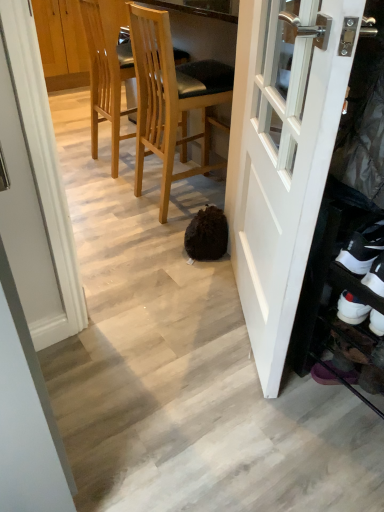
Find the location of a particular element. unoccupied area in front of light brown wood chair at center, the 1th chair in the left-to-right sequence is located at coordinates (105, 185).